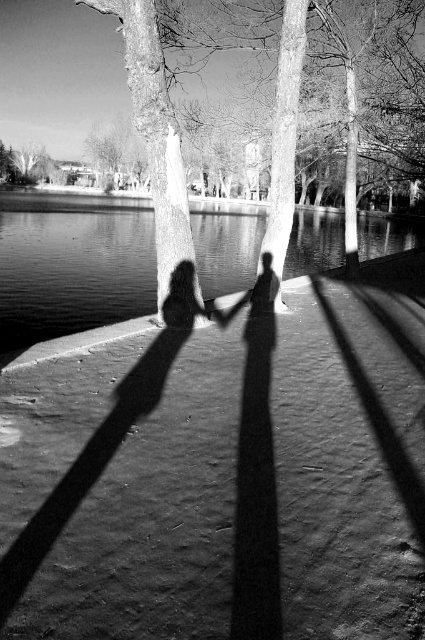
In the scene shown: Is smooth water at center positioned before smooth bark tree at upper center?

No, it is not.

Who is more forward, (19,296) or (368,1)?

Positioned in front is point (19,296).

I want to click on smooth water at center, so tap(70, 266).

Who is positioned more to the right, smooth water at center or smooth bark tree at upper left?

smooth water at center

Between smooth water at center and smooth bark tree at upper left, which one has less height?

With less height is smooth bark tree at upper left.

Who is more distant from viewer, [336,214] or [25,168]?

The point [25,168] is more distant.

Identify the location of smooth water at center. The height and width of the screenshot is (640, 425). (70, 266).

Does smooth bark tree at upper center lie in front of smooth bark tree at upper left?

Yes, it is.

What do you see at coordinates (274, 93) in the screenshot? I see `smooth bark tree at upper center` at bounding box center [274, 93].

You are a GUI agent. You are given a task and a screenshot of the screen. Output one action in this format:
    pyautogui.click(x=<x>, y=<y>)
    Task: Click on the smooth bark tree at upper center
    The height and width of the screenshot is (640, 425).
    Given the screenshot: What is the action you would take?
    pyautogui.click(x=274, y=93)